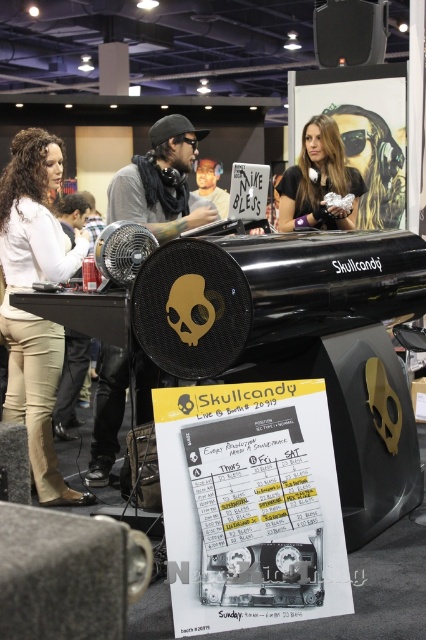
You are at the Skullcandy booth and want to check the schedule for the DJ performances. You see the white paper poster at center and the matte black headphones at center. Which object should you look at to find the schedule?

The white paper poster at center has a greater height compared to matte black headphones at center, so you should look at the white paper poster at center to find the schedule.

You are at the Skullcandy booth and want to take a photo of both the black matte speaker at lower left and the matte black headphones at center. Which object should you focus on first to ensure both are in clear view?

You should focus on the black matte speaker at lower left first since it is closer to you than the matte black headphones at center, ensuring both are in clear view by adjusting the camera focus accordingly.